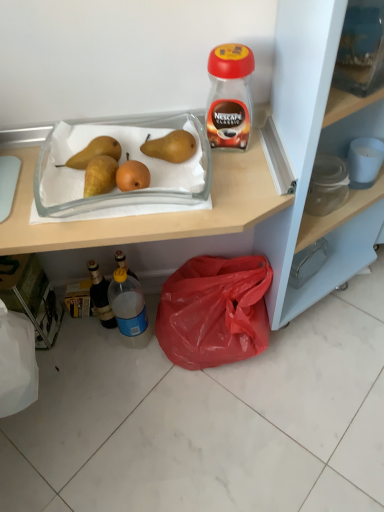
At what (x,y) coordinates should I click in order to perform the action: click on vacant space to the right of red plastic bag at lower right. Please return your answer as a coordinate pair (x, y). Looking at the image, I should click on (318, 349).